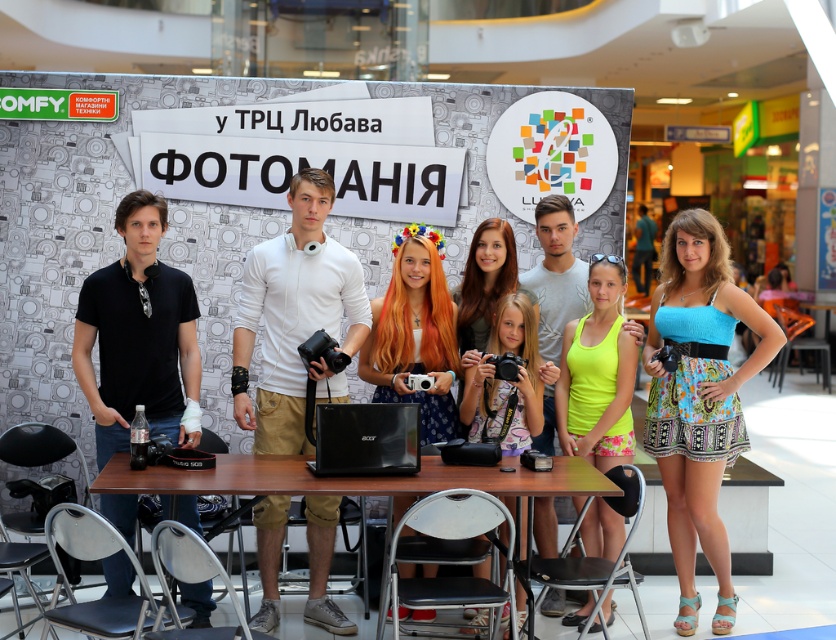
Question: Among these objects, which one is farthest from the camera?

Choices:
 (A) shiny orange hair at center
 (B) blue printed dress at center
 (C) neon yellow tank top at center
 (D) brown wooden table at center

Answer: (C)

Question: Where is blue printed dress at center located in relation to black matte shirt at left in the image?

Choices:
 (A) left
 (B) right

Answer: (B)

Question: Is blue printed dress at center behind brown wooden table at center?

Choices:
 (A) no
 (B) yes

Answer: (B)

Question: Which object appears closest to the camera in this image?

Choices:
 (A) black matte shirt at left
 (B) brown wooden table at center

Answer: (B)

Question: Estimate the real-world distances between objects in this image. Which object is farther from the blue printed dress at center?

Choices:
 (A) shiny orange hair at center
 (B) white matte shirt at center
 (C) black matte shirt at left

Answer: (C)

Question: Does white matte shirt at center have a smaller size compared to shiny orange hair at center?

Choices:
 (A) yes
 (B) no

Answer: (B)